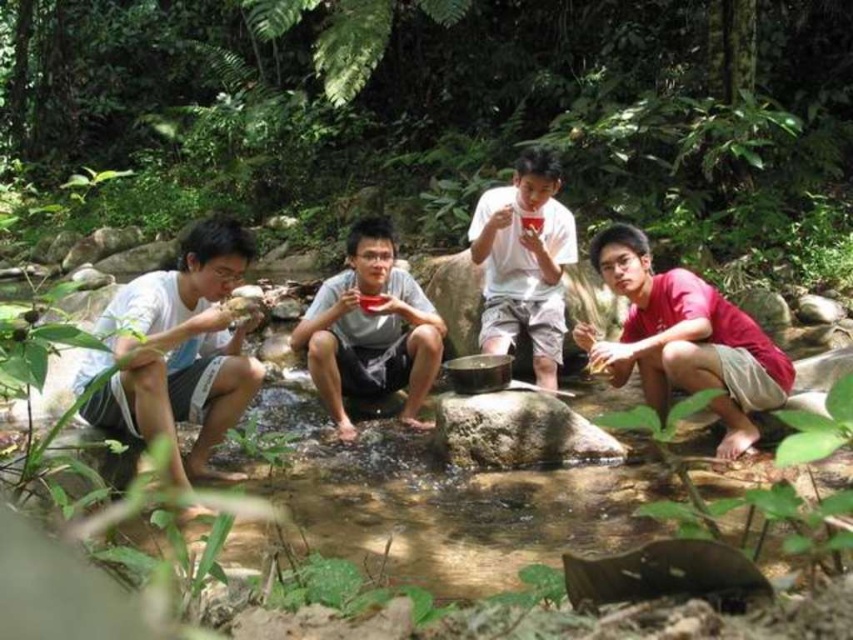
Does clear water at creek center have a greater height compared to gray matte bowl at center?

No, clear water at creek center is not taller than gray matte bowl at center.

Is clear water at creek center to the left of gray matte bowl at center from the viewer's perspective?

In fact, clear water at creek center is to the right of gray matte bowl at center.

This screenshot has width=853, height=640. What do you see at coordinates (459, 509) in the screenshot?
I see `clear water at creek center` at bounding box center [459, 509].

I want to click on clear water at creek center, so click(x=459, y=509).

Is gray matte bowl at center taller than smooth gray rock at center?

Yes, gray matte bowl at center is taller than smooth gray rock at center.

Is point (351, 332) in front of point (453, 403)?

That is False.

This screenshot has width=853, height=640. I want to click on gray matte bowl at center, so click(x=370, y=330).

Is green leafy forest at upper center smaller than gray matte bowl at center?

Result: No.

Does green leafy forest at upper center appear under gray matte bowl at center?

No, green leafy forest at upper center is not below gray matte bowl at center.

Between point (527, 28) and point (338, 378), which one is positioned behind?

The point (527, 28) is behind.

In order to click on green leafy forest at upper center in this screenshot , I will do `click(444, 115)`.